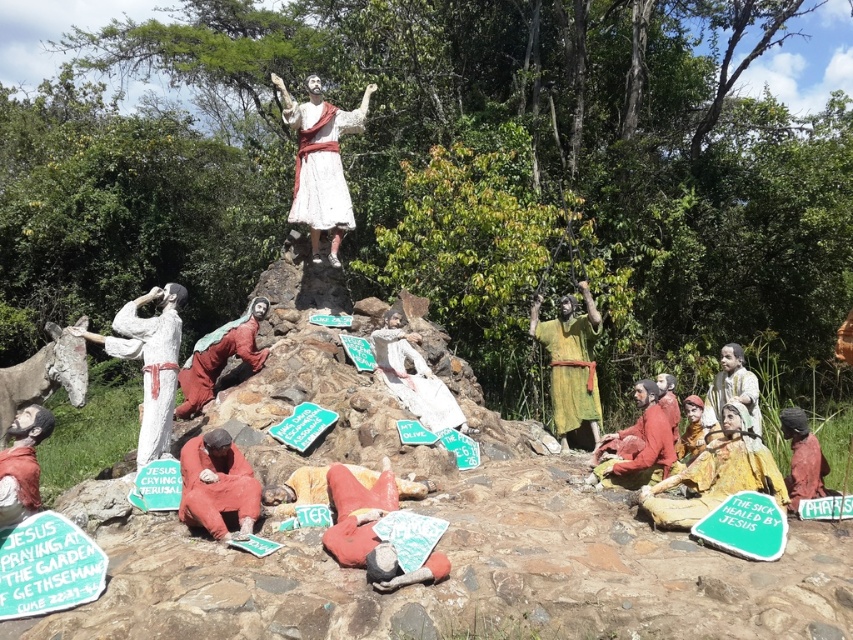
You are an art student analyzing this religious artwork. You notice a point at coordinates (299,490). Which object in the scene does this point belong to?

The point at coordinates (299,490) is on the matte red robe at center.

You are an art conservator examining the outdoor religious scene. You need to clean the matte gold statue at lower right and the green fabric figure at center. Since you can only clean one at a time, which statue should you clean first to avoid obstructing the view of the other?

The matte gold statue at lower right is behind the green fabric figure at center. Therefore, you should clean the green fabric figure at center first to avoid obstructing the view of the matte gold statue at lower right while cleaning it.

You are an art conservator assessing the statues in the outdoor religious scene. You need to determine which statue is narrower between the matte yellow statue at lower right and the white painted statue at left. Which one is narrower?

The matte yellow statue at lower right is narrower than the white painted statue at left.